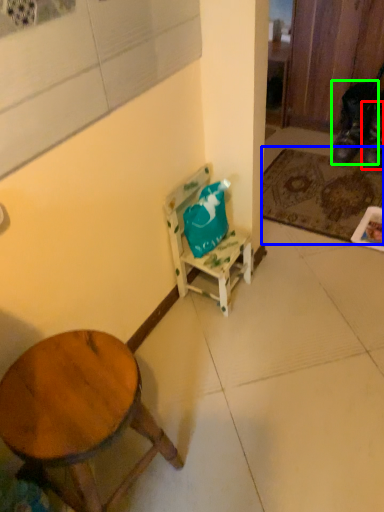
Question: Based on their relative distances, which object is farther from shoe (highlighted by a red box)? Choose from mat (highlighted by a blue box) and shoe (highlighted by a green box).

Choices:
 (A) mat
 (B) shoe

Answer: (A)